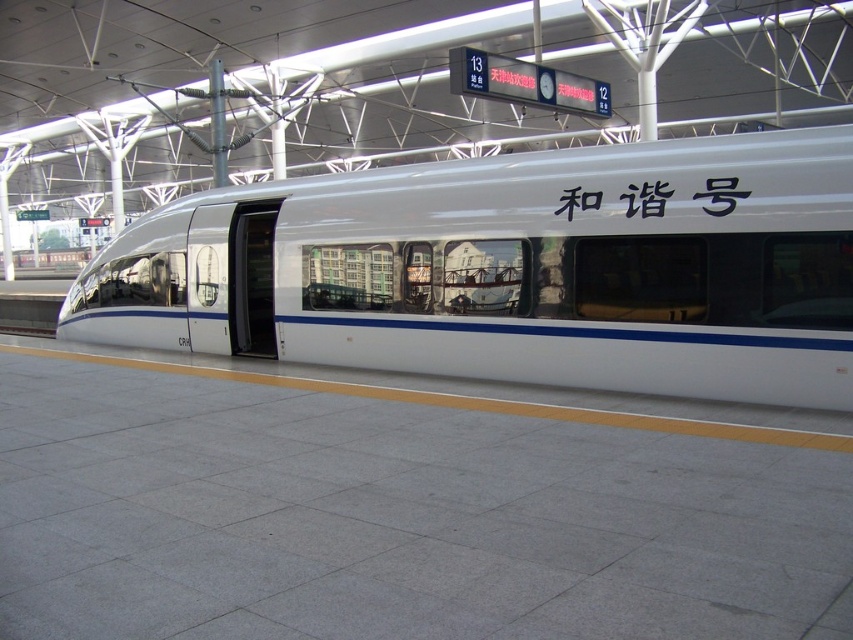
Can you confirm if gray concrete platform at center is taller than white matte text at center?

Correct, gray concrete platform at center is much taller as white matte text at center.

Is gray concrete platform at center wider than white matte text at center?

Yes.

This screenshot has height=640, width=853. What do you see at coordinates (399, 516) in the screenshot?
I see `gray concrete platform at center` at bounding box center [399, 516].

Locate an element on the screen. gray concrete platform at center is located at coordinates (399, 516).

Does white glossy train at center have a larger size compared to white matte text at center?

Indeed, white glossy train at center has a larger size compared to white matte text at center.

Between point (393, 342) and point (628, 216), which one is positioned behind?

The point (393, 342) is more distant.

Is point (808, 216) positioned before point (733, 192)?

Yes, it is in front of point (733, 192).

Locate an element on the screen. This screenshot has height=640, width=853. white glossy train at center is located at coordinates (x=512, y=272).

Identify the location of gray concrete platform at center. The image size is (853, 640). (399, 516).

Is gray concrete platform at center further to the viewer compared to white glossy train at center?

No, gray concrete platform at center is in front of white glossy train at center.

Which is in front, point (291, 408) or point (547, 355)?

Point (291, 408) is more forward.

You are a GUI agent. You are given a task and a screenshot of the screen. Output one action in this format:
    pyautogui.click(x=<x>, y=<y>)
    Task: Click on the gray concrete platform at center
    Image resolution: width=853 pixels, height=640 pixels.
    Given the screenshot: What is the action you would take?
    pyautogui.click(x=399, y=516)